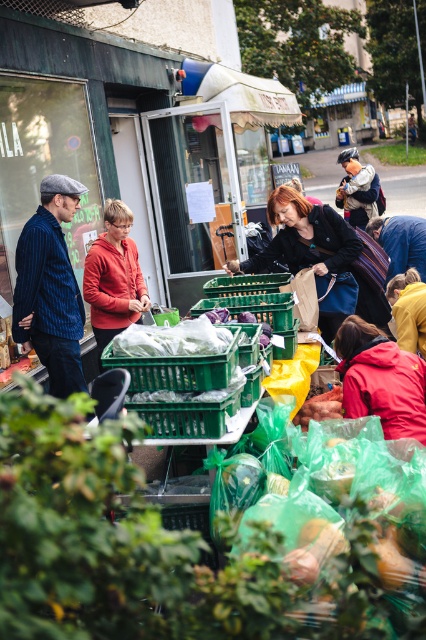
Question: Which point appears farthest from the camera in this image?

Choices:
 (A) (356, 493)
 (B) (51, 248)
 (C) (294, 422)

Answer: (B)

Question: Can you confirm if light blue denim jacket at center is positioned above smooth brown potato at center?

Choices:
 (A) yes
 (B) no

Answer: (A)

Question: Which point is farther from the camera taking this photo?

Choices:
 (A) (360, 273)
 (B) (405, 305)
 (C) (351, 365)
 (D) (227, 531)

Answer: (A)

Question: Which point is closer to the camera taking this photo?

Choices:
 (A) [x=282, y=259]
 (B) [x=92, y=257]
 (C) [x=307, y=410]

Answer: (C)

Question: From the image, what is the correct spatial relationship of matte black jacket at center in relation to orange fleece jacket at center?

Choices:
 (A) right
 (B) left

Answer: (A)

Question: Does translucent plastic bag at lower center have a larger size compared to orange fleece jacket at center?

Choices:
 (A) yes
 (B) no

Answer: (A)